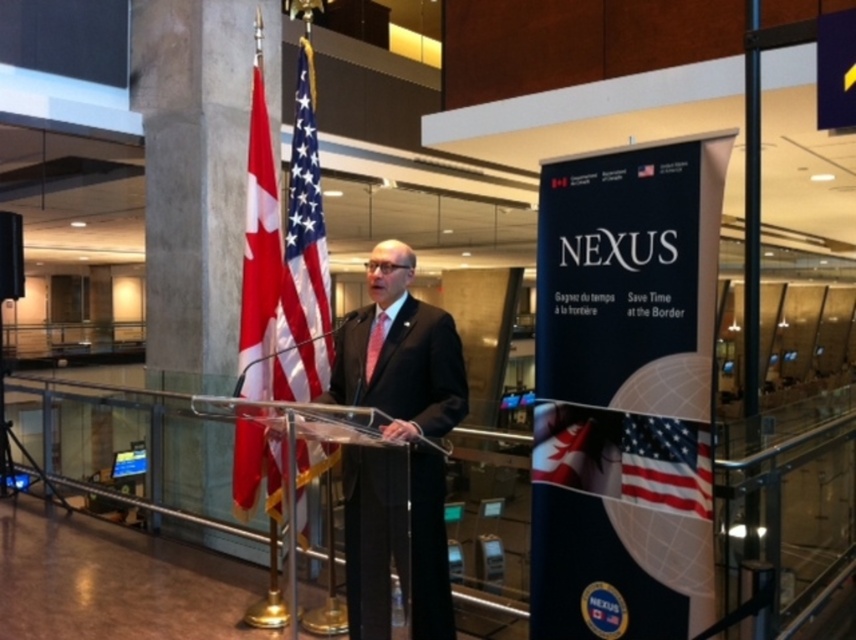
Question: Which of the following is the farthest from the observer?

Choices:
 (A) (373, 362)
 (B) (458, 417)
 (C) (266, 220)

Answer: (C)

Question: Estimate the real-world distances between objects in this image. Which object is closer to the polyester flag at center?

Choices:
 (A) matte red tie at center
 (B) black suit at center

Answer: (B)

Question: Can you confirm if polyester flag at center is positioned below red fabric flag at left?

Choices:
 (A) no
 (B) yes

Answer: (A)

Question: Which of the following is the closest to the observer?

Choices:
 (A) matte red tie at center
 (B) black suit at center
 (C) polyester flag at center
 (D) red fabric flag at left

Answer: (B)

Question: Can you confirm if red fabric flag at left is wider than matte red tie at center?

Choices:
 (A) yes
 (B) no

Answer: (A)

Question: Is black suit at center behind polyester flag at center?

Choices:
 (A) yes
 (B) no

Answer: (B)